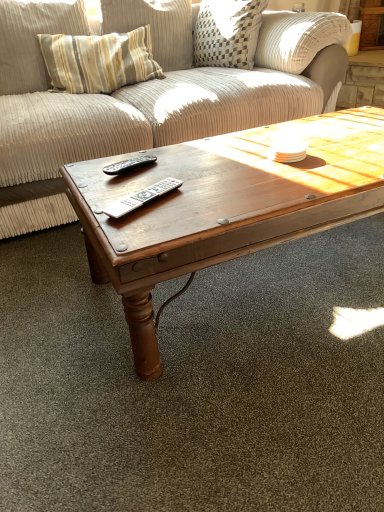
The height and width of the screenshot is (512, 384). I want to click on free point above wooden coffee table at center (from a real-world perspective), so click(226, 163).